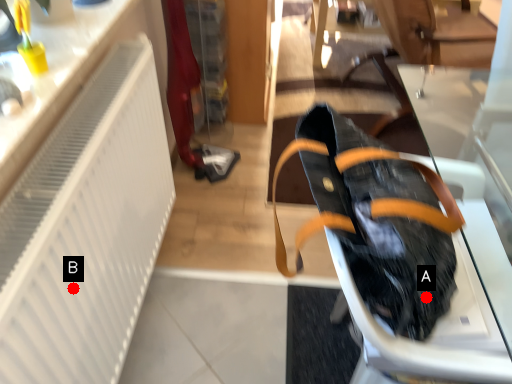
Question: Two points are circled on the image, labeled by A and B beside each circle. Which point is farther to the camera?

Choices:
 (A) A is further
 (B) B is further

Answer: (B)